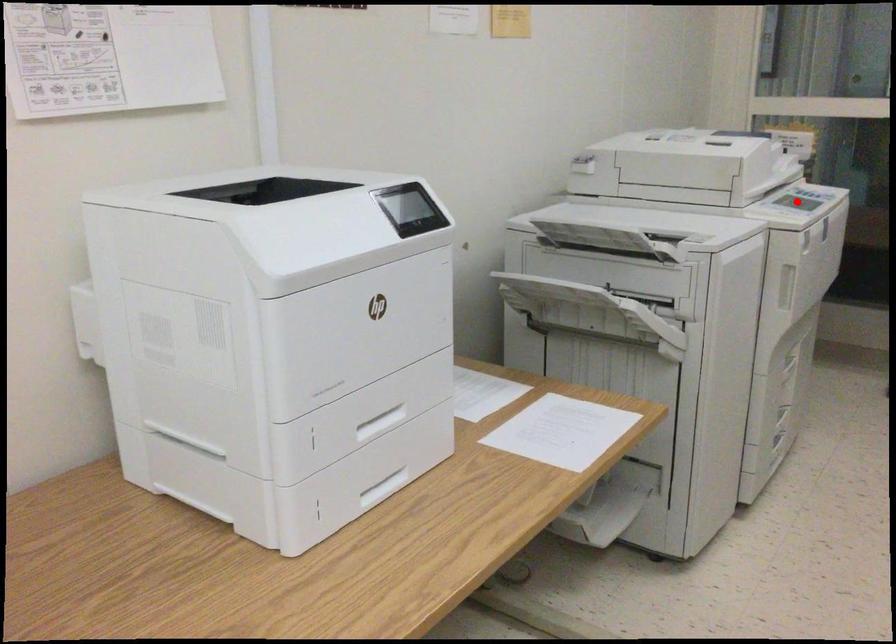
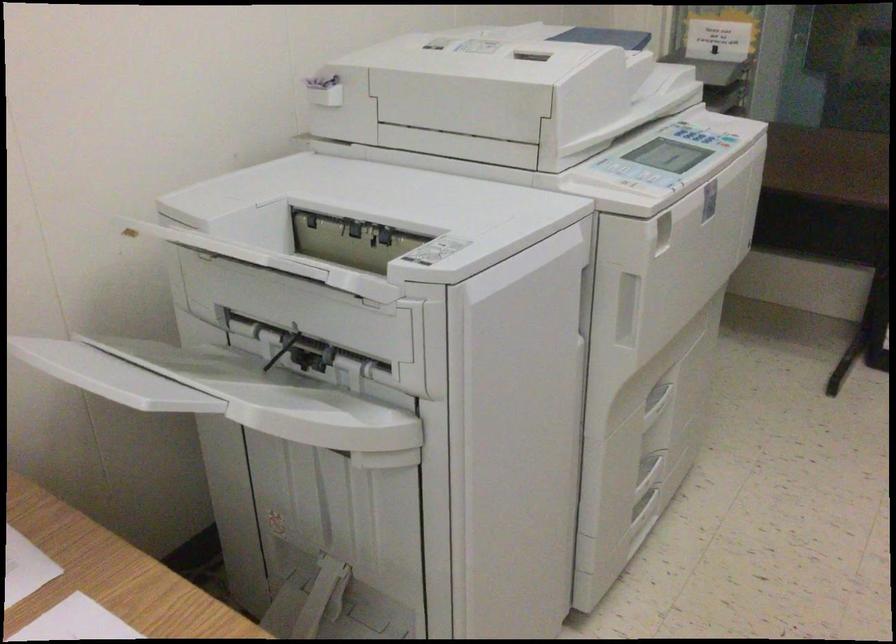
Question: I am providing you with two images of the same scene from different viewpoints. In image1, a red point is highlighted. Considering the same 3D point in image2, which of the following is correct?

Choices:
 (A) It is closer
 (B) It is farther

Answer: (A)